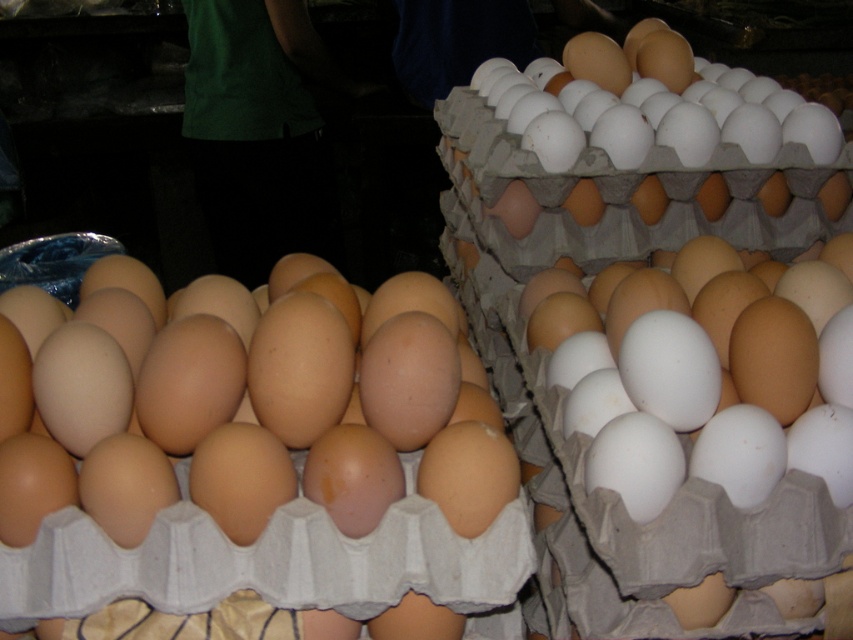
Question: Which is farther from the white matte egg at upper right?

Choices:
 (A) brown matte egg at center
 (B) white matte egg at center

Answer: (A)

Question: Is brown matte egg at center in front of white matte egg at upper right?

Choices:
 (A) no
 (B) yes

Answer: (B)

Question: Can you confirm if white matte egg at center is wider than white matte egg at upper right?

Choices:
 (A) yes
 (B) no

Answer: (B)

Question: Which object is the closest to the white matte egg at center?

Choices:
 (A) brown matte egg at center
 (B) white matte egg at upper right

Answer: (A)

Question: Which of the following is the closest to the observer?

Choices:
 (A) white matte egg at upper right
 (B) brown matte egg at center

Answer: (B)

Question: Is white matte egg at center smaller than white matte egg at upper right?

Choices:
 (A) yes
 (B) no

Answer: (A)